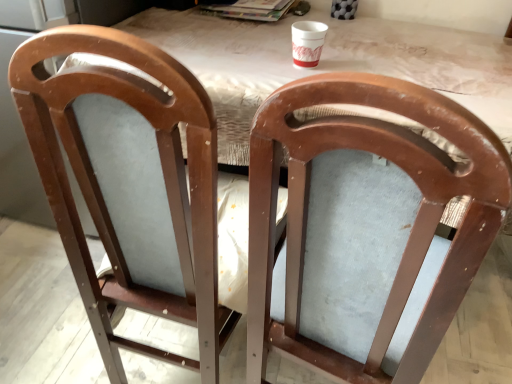
The image size is (512, 384). In order to click on matte wood table at center in this screenshot , I will do `click(326, 63)`.

I want to click on matte wood table at center, so click(326, 63).

Between matte wood table at center and matte wood chair at center, the second chair in the left-to-right sequence, which one has larger width?

matte wood table at center.

Based on the photo, which is nearer, (266, 86) or (393, 297)?

Point (266, 86) is positioned farther from the camera compared to point (393, 297).

Can you confirm if matte wood table at center is shorter than matte wood chair at center, which ranks as the 1th chair in right-to-left order?

Yes.

From their relative heights in the image, would you say matte wood chair at center, placed as the 2th chair when sorted from right to left, is taller or shorter than white paper cup at upper center?

matte wood chair at center, placed as the 2th chair when sorted from right to left, is taller than white paper cup at upper center.

Considering the relative positions of matte wood chair at center, arranged as the 1th chair when viewed from the left, and white paper cup at upper center in the image provided, is matte wood chair at center, arranged as the 1th chair when viewed from the left, to the left of white paper cup at upper center from the viewer's perspective?

Yes.

Would you say white paper cup at upper center is part of matte wood chair at center, placed as the 2th chair when sorted from right to left,'s contents?

No.

Is point (227, 318) less distant than point (309, 28)?

Yes, it is.

Is matte wood chair at center, arranged as the 1th chair when viewed from the left, with matte wood table at center?

matte wood chair at center, arranged as the 1th chair when viewed from the left, is not next to matte wood table at center, and they're not touching.

Which of these two, matte wood chair at center, placed as the 2th chair when sorted from right to left, or matte wood table at center, is wider?

matte wood table at center.

Is point (146, 260) positioned after point (464, 53)?

No, it is not.

Is matte wood chair at center, placed as the 2th chair when sorted from right to left, in front of or behind matte wood table at center in the image?

matte wood chair at center, placed as the 2th chair when sorted from right to left, is positioned closer to the viewer than matte wood table at center.

Is matte wood chair at center, which ranks as the 1th chair in right-to-left order, not close to matte wood table at center?

No, matte wood chair at center, which ranks as the 1th chair in right-to-left order, is in close proximity to matte wood table at center.

From a real-world perspective, is matte wood chair at center, the second chair in the left-to-right sequence, on top of matte wood table at center?

Actually, matte wood chair at center, the second chair in the left-to-right sequence, is physically below matte wood table at center in the real world.

Is matte wood chair at center, the second chair in the left-to-right sequence, inside the boundaries of matte wood table at center, or outside?

matte wood chair at center, the second chair in the left-to-right sequence, is spatially situated outside matte wood table at center.

Do you think white paper cup at upper center is within matte wood chair at center, placed as the 2th chair when sorted from right to left, or outside of it?

white paper cup at upper center is not inside matte wood chair at center, placed as the 2th chair when sorted from right to left, it's outside.

Is white paper cup at upper center at the right side of matte wood chair at center, arranged as the 1th chair when viewed from the left?

Correct, you'll find white paper cup at upper center to the right of matte wood chair at center, arranged as the 1th chair when viewed from the left.

Locate an element on the screen. Image resolution: width=512 pixels, height=384 pixels. cup above the matte wood chair at center, placed as the 2th chair when sorted from right to left (from a real-world perspective) is located at coordinates (307, 42).

Which is correct: matte wood chair at center, arranged as the 1th chair when viewed from the left, is inside matte wood chair at center, the second chair in the left-to-right sequence, or outside of it?

matte wood chair at center, arranged as the 1th chair when viewed from the left, exists outside the volume of matte wood chair at center, the second chair in the left-to-right sequence.

How many degrees apart are the facing directions of matte wood chair at center, arranged as the 1th chair when viewed from the left, and matte wood chair at center, the second chair in the left-to-right sequence?

The angular difference between matte wood chair at center, arranged as the 1th chair when viewed from the left, and matte wood chair at center, the second chair in the left-to-right sequence, is 11 degrees.

From the image's perspective, between matte wood chair at center, placed as the 2th chair when sorted from right to left, and matte wood chair at center, the second chair in the left-to-right sequence, who is located below?

From the image's view, matte wood chair at center, the second chair in the left-to-right sequence, is below.

The height and width of the screenshot is (384, 512). I want to click on chair that appears above the matte wood chair at center, arranged as the 1th chair when viewed from the left (from a real-world perspective), so click(412, 225).

From a real-world perspective, is matte wood chair at center, which ranks as the 1th chair in right-to-left order, physically below white paper cup at upper center?

Correct, in the physical world, matte wood chair at center, which ranks as the 1th chair in right-to-left order, is lower than white paper cup at upper center.

From the image's perspective, which one is positioned lower, matte wood chair at center, which ranks as the 1th chair in right-to-left order, or white paper cup at upper center?

matte wood chair at center, which ranks as the 1th chair in right-to-left order, is shown below in the image.

Which is nearer, [467,182] or [309,35]?

Point [467,182] appears to be closer to the viewer than point [309,35].

Where is `chair on the right of matte wood table at center`? This screenshot has width=512, height=384. chair on the right of matte wood table at center is located at coordinates (412, 225).

In order to click on chair that is the 1st object located below the white paper cup at upper center (from the image's perspective) in this screenshot , I will do point(130,184).

Which object lies nearer to the anchor point matte wood chair at center, arranged as the 1th chair when viewed from the left, matte wood chair at center, the second chair in the left-to-right sequence, or white paper cup at upper center?

Based on the image, matte wood chair at center, the second chair in the left-to-right sequence, appears to be nearer to matte wood chair at center, arranged as the 1th chair when viewed from the left.

Looking at the image, which one is located further to matte wood chair at center, arranged as the 1th chair when viewed from the left, matte wood chair at center, which ranks as the 1th chair in right-to-left order, or matte wood table at center?

The object further to matte wood chair at center, arranged as the 1th chair when viewed from the left, is matte wood table at center.

Based on their spatial positions, is white paper cup at upper center or matte wood table at center closer to matte wood chair at center, placed as the 2th chair when sorted from right to left?

matte wood table at center is closer to matte wood chair at center, placed as the 2th chair when sorted from right to left.

Looking at this image, when comparing their distances from matte wood table at center, does white paper cup at upper center or matte wood chair at center, the second chair in the left-to-right sequence, seem closer?

Among the two, white paper cup at upper center is located nearer to matte wood table at center.

When comparing their distances from white paper cup at upper center, does matte wood table at center or matte wood chair at center, arranged as the 1th chair when viewed from the left, seem closer?

The object closer to white paper cup at upper center is matte wood table at center.

Based on their spatial positions, is matte wood table at center or white paper cup at upper center further from matte wood chair at center, which ranks as the 1th chair in right-to-left order?

Based on the image, white paper cup at upper center appears to be further to matte wood chair at center, which ranks as the 1th chair in right-to-left order.

Consider the image. Estimate the real-world distances between objects in this image. Which object is closer to matte wood chair at center, which ranks as the 1th chair in right-to-left order, matte wood chair at center, arranged as the 1th chair when viewed from the left, or matte wood table at center?

Among the two, matte wood chair at center, arranged as the 1th chair when viewed from the left, is located nearer to matte wood chair at center, which ranks as the 1th chair in right-to-left order.

Which object lies further to the anchor point matte wood chair at center, placed as the 2th chair when sorted from right to left, matte wood table at center or white paper cup at upper center?

Based on the image, white paper cup at upper center appears to be further to matte wood chair at center, placed as the 2th chair when sorted from right to left.

At what (x,y) coordinates should I click in order to perform the action: click on chair between matte wood table at center and matte wood chair at center, the second chair in the left-to-right sequence, vertically. Please return your answer as a coordinate pair (x, y). The height and width of the screenshot is (384, 512). Looking at the image, I should click on (130, 184).

Where is `table between matte wood chair at center, placed as the 2th chair when sorted from right to left, and white paper cup at upper center in the front-back direction`? The image size is (512, 384). table between matte wood chair at center, placed as the 2th chair when sorted from right to left, and white paper cup at upper center in the front-back direction is located at coordinates (326, 63).

This screenshot has width=512, height=384. What are the coordinates of `chair between matte wood chair at center, which ranks as the 1th chair in right-to-left order, and white paper cup at upper center, along the z-axis` in the screenshot? It's located at (130, 184).

Where is `table between matte wood chair at center, which ranks as the 1th chair in right-to-left order, and white paper cup at upper center, along the z-axis`? The image size is (512, 384). table between matte wood chair at center, which ranks as the 1th chair in right-to-left order, and white paper cup at upper center, along the z-axis is located at coordinates (326, 63).